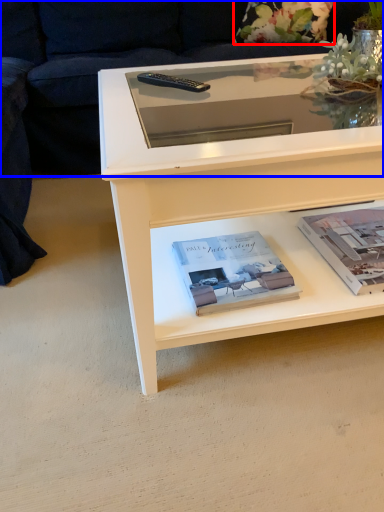
Question: Which of the following is the farthest to the observer, flower (highlighted by a red box) or couch (highlighted by a blue box)?

Choices:
 (A) flower
 (B) couch

Answer: (A)